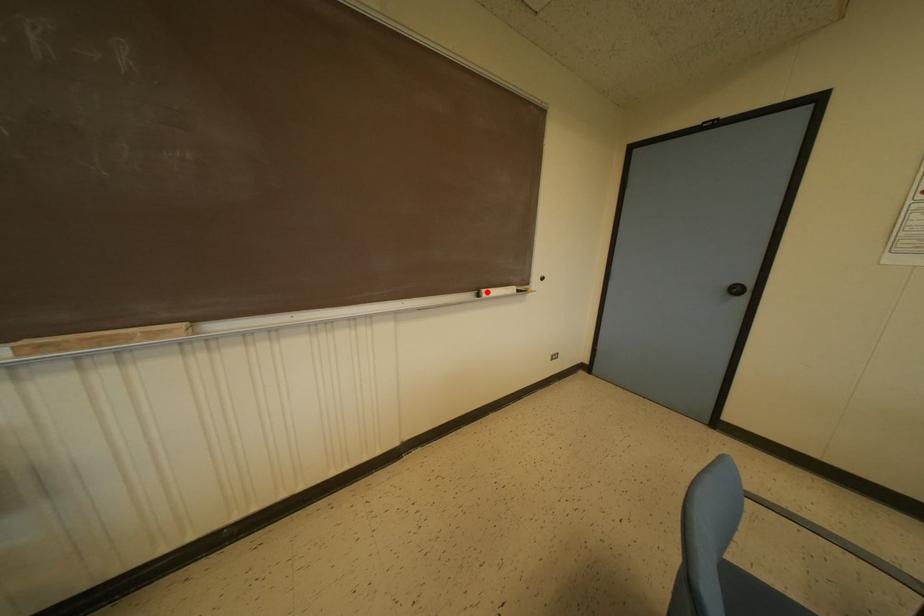
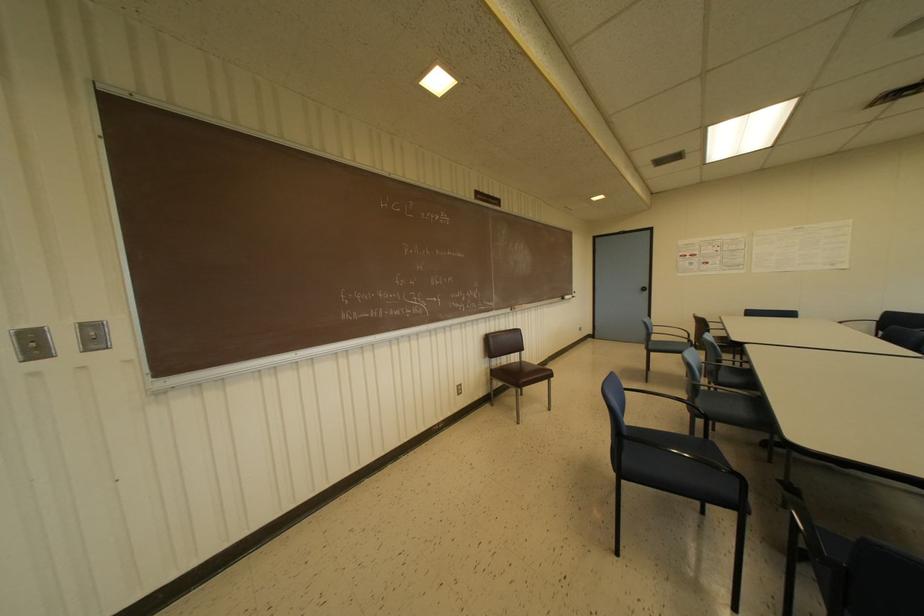
Where in the second image is the point corresponding to the highlighted location from the first image?

(565, 296)